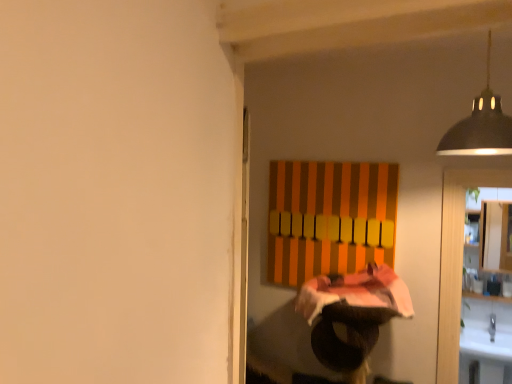
Question: From the image's perspective, is black metal lampshade at upper right positioned above or below white glossy cabinet at right?

Choices:
 (A) above
 (B) below

Answer: (A)

Question: Is point (490, 142) positioned closer to the camera than point (501, 233)?

Choices:
 (A) farther
 (B) closer

Answer: (B)

Question: From a real-world perspective, is black metal lampshade at upper right above or below white glossy cabinet at right?

Choices:
 (A) above
 (B) below

Answer: (A)

Question: Would you say white glossy cabinet at right is to the left or to the right of black metal lampshade at upper right in the picture?

Choices:
 (A) left
 (B) right

Answer: (B)

Question: Based on their sizes in the image, would you say white glossy cabinet at right is bigger or smaller than black metal lampshade at upper right?

Choices:
 (A) big
 (B) small

Answer: (A)

Question: Is white glossy cabinet at right spatially inside black metal lampshade at upper right, or outside of it?

Choices:
 (A) inside
 (B) outside

Answer: (B)

Question: From the image's perspective, is white glossy cabinet at right positioned above or below black metal lampshade at upper right?

Choices:
 (A) above
 (B) below

Answer: (B)